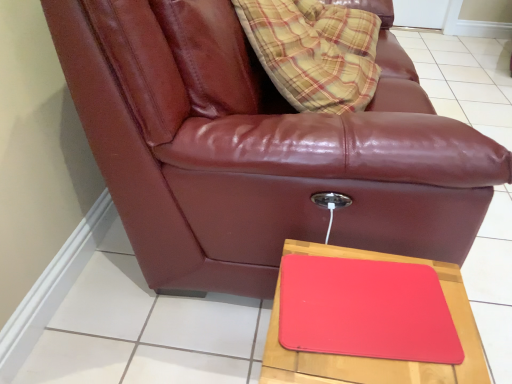
Question: Considering the relative sizes of matte leather couch at center and rubberized red tray at lower right in the image provided, is matte leather couch at center thinner than rubberized red tray at lower right?

Choices:
 (A) no
 (B) yes

Answer: (A)

Question: From the image's perspective, is matte leather couch at center located beneath rubberized red tray at lower right?

Choices:
 (A) yes
 (B) no

Answer: (B)

Question: Are matte leather couch at center and rubberized red tray at lower right beside each other?

Choices:
 (A) no
 (B) yes

Answer: (A)

Question: Is matte leather couch at center to the left of rubberized red tray at lower right from the viewer's perspective?

Choices:
 (A) no
 (B) yes

Answer: (B)

Question: Would you say matte leather couch at center contains rubberized red tray at lower right?

Choices:
 (A) no
 (B) yes

Answer: (A)

Question: Is matte leather couch at center oriented towards rubberized red tray at lower right?

Choices:
 (A) no
 (B) yes

Answer: (A)

Question: Can you confirm if rubberized red tray at lower right is shorter than matte leather couch at center?

Choices:
 (A) yes
 (B) no

Answer: (A)

Question: From the image's perspective, is rubberized red tray at lower right below matte leather couch at center?

Choices:
 (A) yes
 (B) no

Answer: (A)

Question: Is rubberized red tray at lower right far from matte leather couch at center?

Choices:
 (A) no
 (B) yes

Answer: (A)

Question: Can you see rubberized red tray at lower right touching matte leather couch at center?

Choices:
 (A) yes
 (B) no

Answer: (B)

Question: Is rubberized red tray at lower right not inside matte leather couch at center?

Choices:
 (A) yes
 (B) no

Answer: (A)

Question: Does rubberized red tray at lower right have a smaller size compared to matte leather couch at center?

Choices:
 (A) yes
 (B) no

Answer: (A)

Question: Considering their positions, is rubberized red tray at lower right located in front of or behind matte leather couch at center?

Choices:
 (A) front
 (B) behind

Answer: (A)